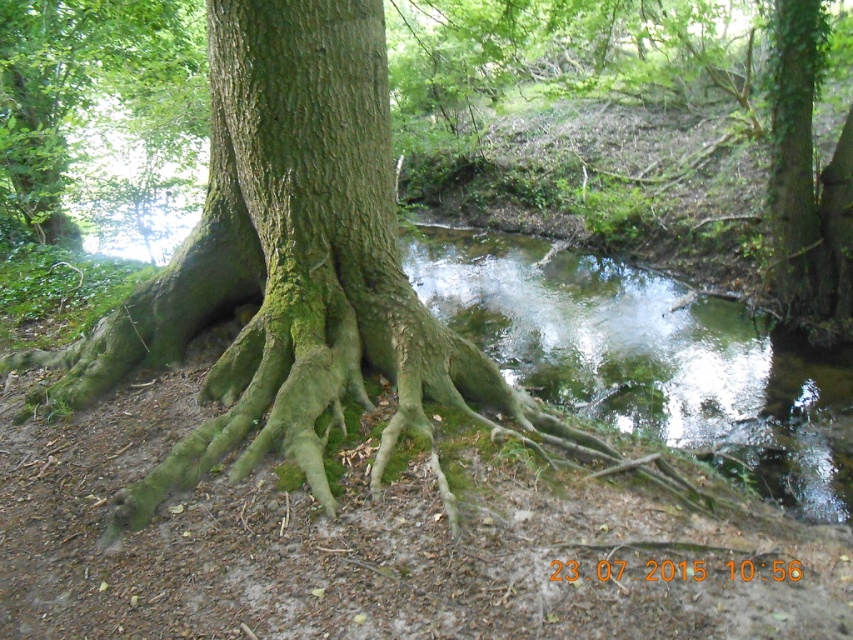
Question: Does green mossy water at center lie behind green mossy roots at center?

Choices:
 (A) no
 (B) yes

Answer: (A)

Question: Which of the following is the closest to the observer?

Choices:
 (A) green mossy water at center
 (B) green mossy roots at center

Answer: (A)

Question: In this image, where is green mossy water at center located relative to green mossy roots at center?

Choices:
 (A) above
 (B) below

Answer: (B)

Question: Which point is closer to the camera taking this photo?

Choices:
 (A) (776, 433)
 (B) (173, 24)

Answer: (A)

Question: From the image, what is the correct spatial relationship of green mossy water at center in relation to green mossy roots at center?

Choices:
 (A) above
 (B) below

Answer: (B)

Question: Which point is closer to the camera?

Choices:
 (A) green mossy water at center
 (B) green mossy roots at center

Answer: (A)